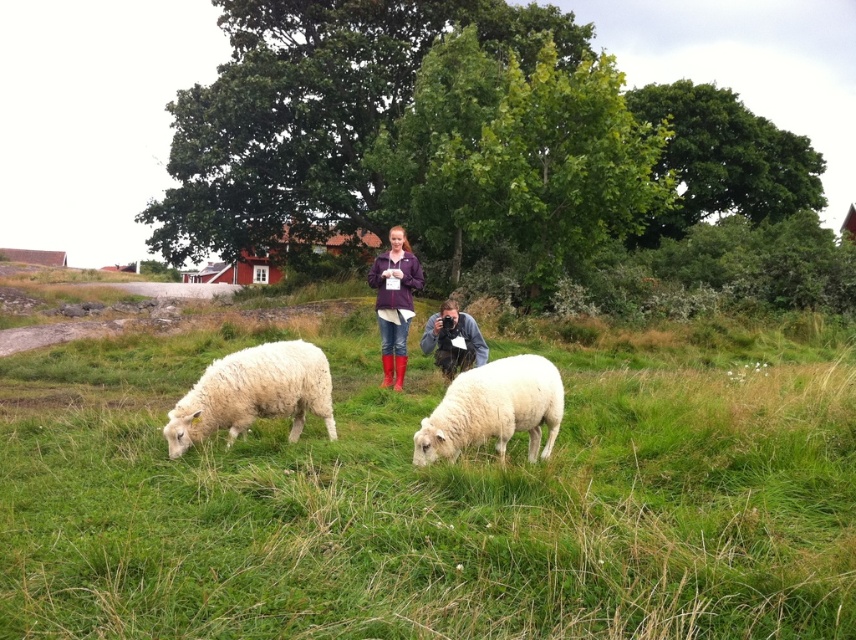
Who is positioned more to the left, green soft grass at center or white woolly sheep at lower left?

white woolly sheep at lower left

Between point (117, 419) and point (250, 385), which one is positioned behind?

The point (117, 419) is more distant.

Which is behind, point (256, 512) or point (248, 420)?

Positioned behind is point (248, 420).

The width and height of the screenshot is (856, 640). Identify the location of green soft grass at center. (432, 500).

Is white woolly sheep at lower left closer to the viewer compared to white woolly sheep at center?

No, white woolly sheep at lower left is further to the viewer.

Does point (307, 404) lie in front of point (489, 365)?

No, it is behind (489, 365).

Which is behind, point (289, 384) or point (551, 397)?

The point (289, 384) is more distant.

This screenshot has height=640, width=856. In order to click on white woolly sheep at lower left in this screenshot , I will do `click(253, 394)`.

Does white woolly sheep at lower left have a lesser height compared to purple fleece jacket at center?

Incorrect, white woolly sheep at lower left's height does not fall short of purple fleece jacket at center's.

Is point (165, 428) positioned after point (383, 289)?

No.

Does point (278, 362) come farther from viewer compared to point (397, 328)?

No, it is not.

Identify the location of white woolly sheep at lower left. (253, 394).